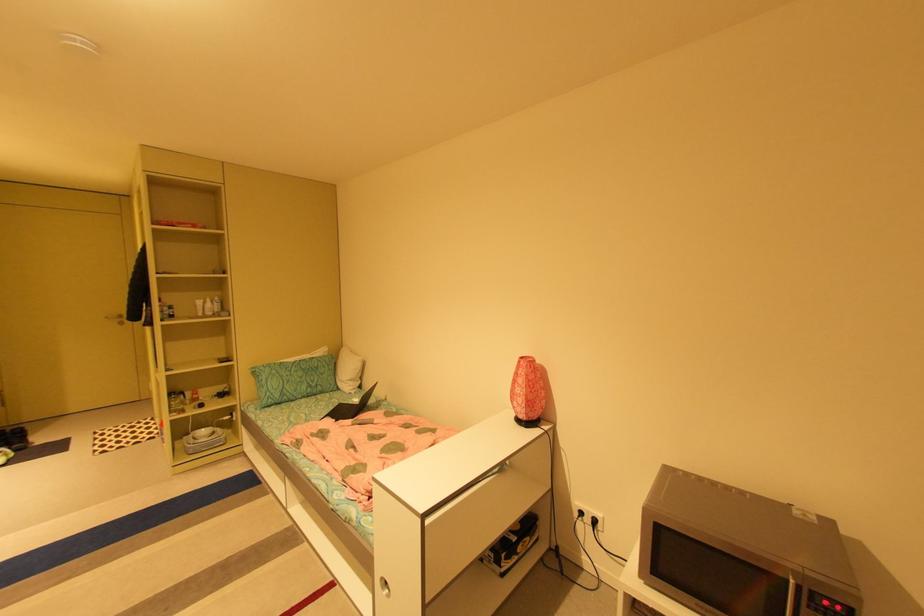
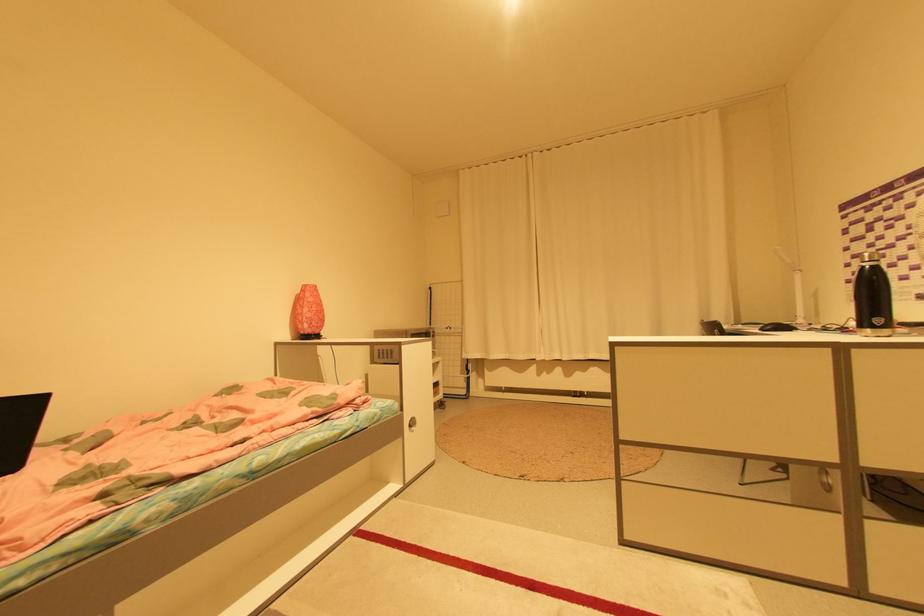
Find the pixel in the second image that matches (x=528, y=358) in the first image.

(311, 285)